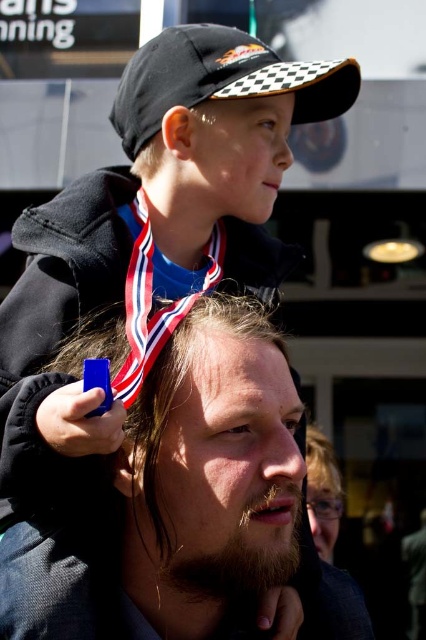
You are a photographer trying to capture a closeup of the dark brown textured hair at center and the black checkered baseball cap at upper center. Which object is closer to the camera?

The dark brown textured hair at center is positioned under the black checkered baseball cap at upper center, so the black checkered baseball cap at upper center is closer to the camera.

You are a photographer standing at the center of the scene. You want to take a photo of the dark brown textured hair at center and the matte blue neck at center. Given that your camera has a maximum focus range of 2 meters, will both subjects be in focus?

The dark brown textured hair at center is 2.84 meters away from the matte blue neck at center. Since the camera can only focus up to 2 meters, the distance between them exceeds the focus range, so both subjects cannot be in focus simultaneously.

You are a photographer standing at the camera position. You want to take a closeup shot of the dark brown textured hair at center. Considering the distance, can you get a clear closeup without moving closer?

The dark brown textured hair at center is 9.15 meters away from the camera. A standard camera lens can focus on subjects at this distance, so yes, you can take a clear closeup without moving closer.